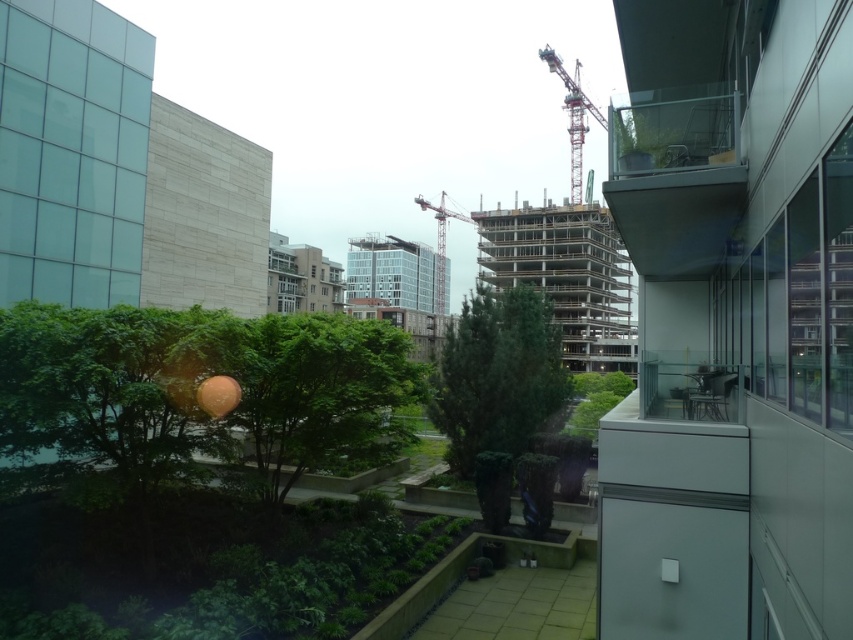
You are standing at the point labeled point (393, 339). You need to walk to a point that is 42 feet away. Can you reach that point without leaving the paved area?

Yes, because the distance between them is exactly 42.00 feet, which means you can walk to the point 42 feet away while staying on the paved area.

You are standing on the balcony and want to take a photo of both the green textured tree at center and the red metal crane at center. Which object should you focus on first to ensure both are in clear view?

You should focus on the green textured tree at center first since it is closer to you than the red metal crane at center, ensuring both are in focus when using a camera with depth of field.

You are standing on the balcony and want to place a 4.5 meter long bench between the green leafy tree at center and the green textured tree at center. Can you fit the bench between them without moving the trees?

The green leafy tree at center and the green textured tree at center are 4.34 meters apart. Since the bench is 4.5 meters long, which is slightly longer than the distance between the trees, you cannot fit the bench between them without moving the trees.